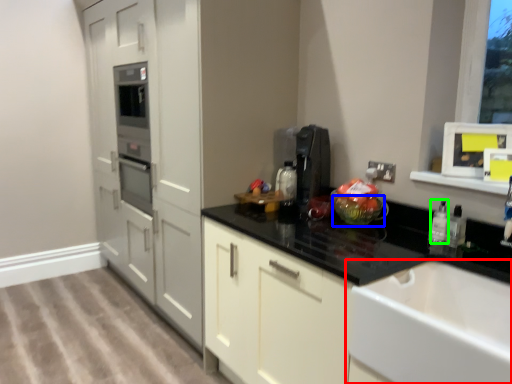
Question: Considering the real-world distances, which object is farthest from sink (highlighted by a red box)? glass bowl (highlighted by a blue box) or bottle (highlighted by a green box)?

Choices:
 (A) glass bowl
 (B) bottle

Answer: (A)